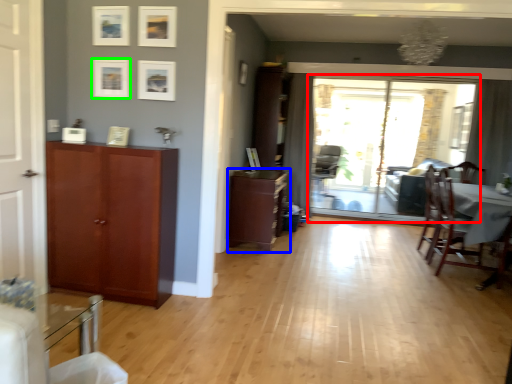
Question: Which object is positioned closest to window screen (highlighted by a red box)? Select from cabinetry (highlighted by a blue box) and picture frame (highlighted by a green box).

Choices:
 (A) cabinetry
 (B) picture frame

Answer: (A)